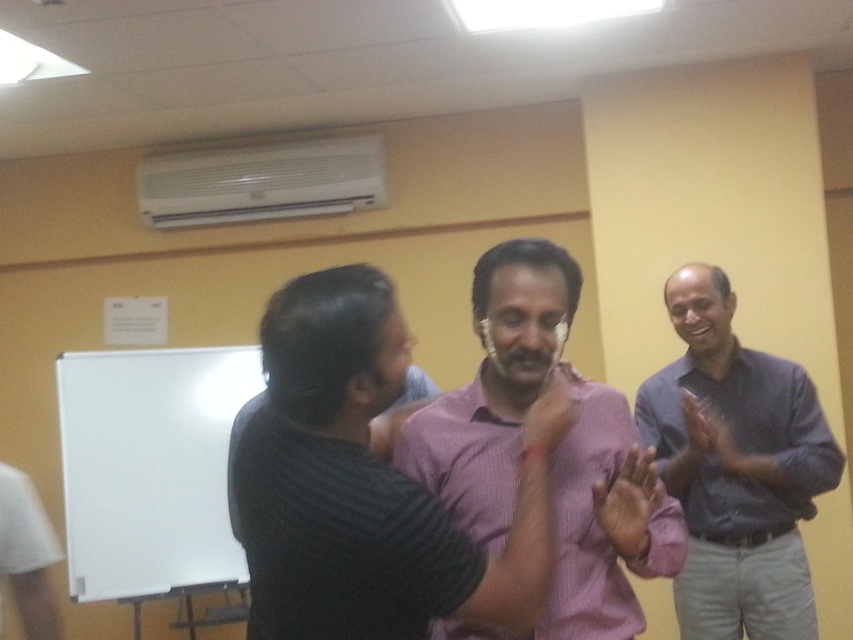
You are organizing a photo shoot and need to place a name tag on the pink striped shirt at center and the gray shirt at right. If the name tags are the same size, which shirt will have a name tag that looks proportionally larger?

The pink striped shirt at center will have a name tag that looks proportionally larger because it is smaller than the gray shirt at right, so the same size name tag will appear larger on the smaller shirt.